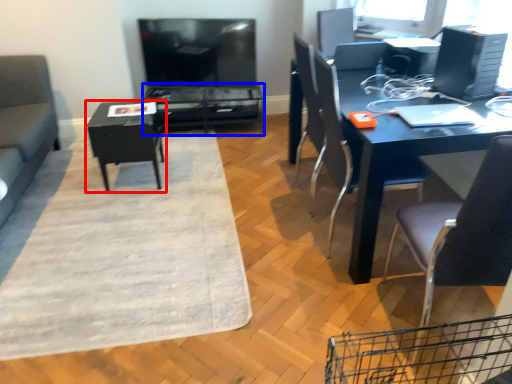
Question: Which object appears closest to the camera in this image, table (highlighted by a red box) or table (highlighted by a blue box)?

Choices:
 (A) table
 (B) table

Answer: (A)